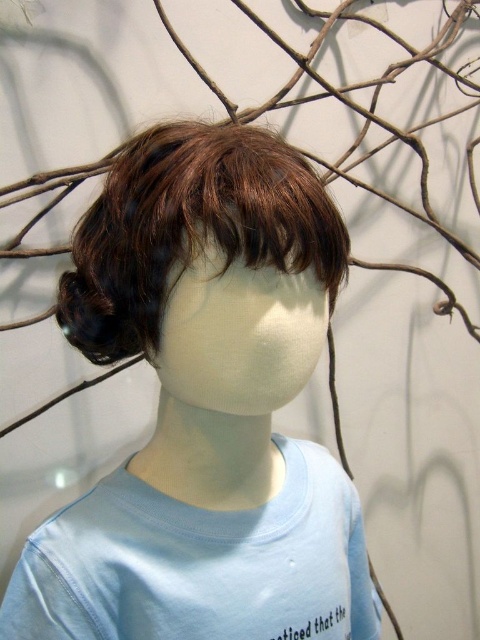
Question: Is brown synthetic wig at center above light blue cotton t-shirt at center?

Choices:
 (A) yes
 (B) no

Answer: (A)

Question: Which object is positioned closest to the brown synthetic wig at center?

Choices:
 (A) light blue cotton t-shirt at center
 (B) brown matte wig at center

Answer: (A)

Question: Which point is farther to the camera?

Choices:
 (A) light blue cotton t-shirt at center
 (B) brown synthetic wig at center
 (C) brown matte wig at center

Answer: (A)

Question: Can you confirm if brown synthetic wig at center is wider than light blue cotton t-shirt at center?

Choices:
 (A) yes
 (B) no

Answer: (A)

Question: In this image, where is light blue cotton t-shirt at center located relative to brown matte wig at center?

Choices:
 (A) right
 (B) left

Answer: (A)

Question: Which object appears farthest from the camera in this image?

Choices:
 (A) light blue cotton t-shirt at center
 (B) brown synthetic wig at center

Answer: (A)